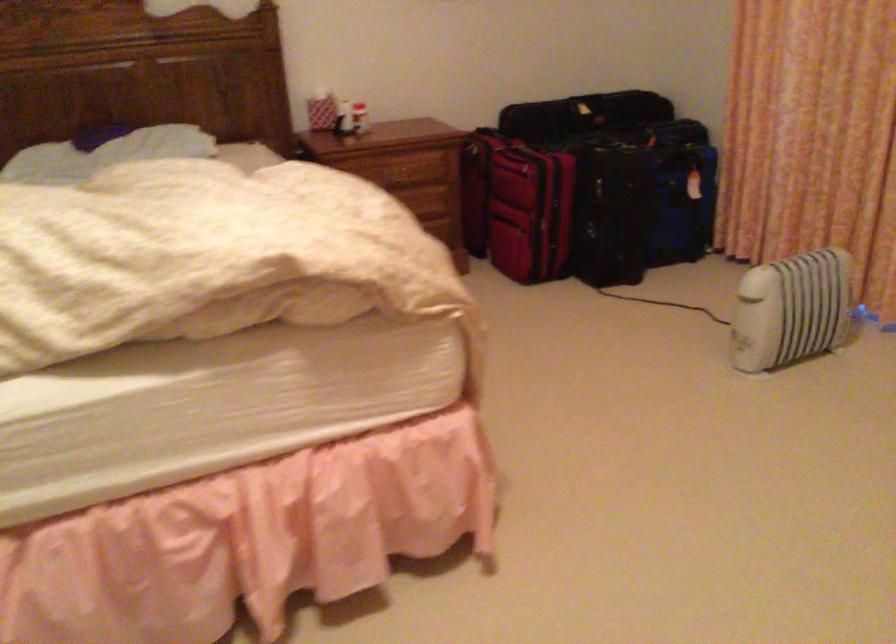
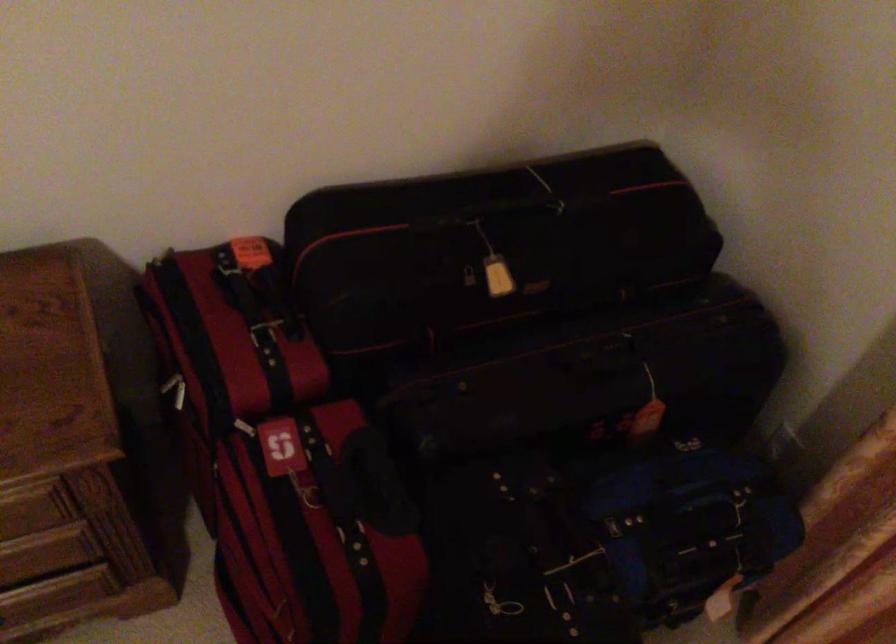
In the second image, find the point that corresponds to point 597,122 in the first image.

(527, 357)